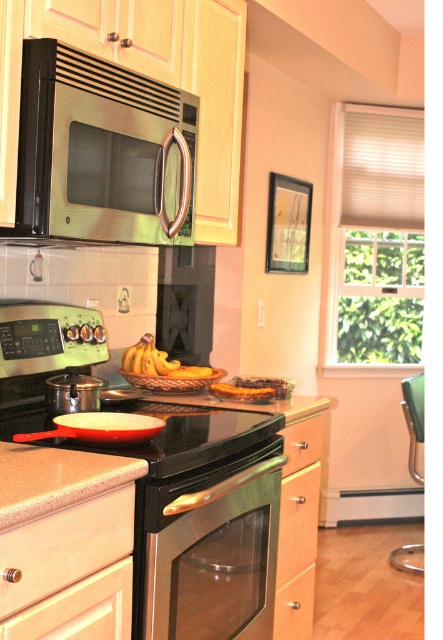
Between white matte drawer at lower left and beige granite countertop at lower center, which one is positioned higher?

beige granite countertop at lower center is above.

Looking at this image, which is more to the right, white matte drawer at lower left or beige granite countertop at lower center?

white matte drawer at lower left is more to the right.

Who is more forward, (131,496) or (24,468)?

Point (24,468) is in front.

At what (x,y) coordinates should I click in order to perform the action: click on white matte drawer at lower left. Please return your answer as a coordinate pair (x, y). The height and width of the screenshot is (640, 443). Looking at the image, I should click on (65, 547).

From the picture: Can you confirm if stainless steel oven at center is shorter than matte wood drawer at lower center?

Incorrect, stainless steel oven at center's height does not fall short of matte wood drawer at lower center's.

Is point (194, 621) positioned behind point (303, 598)?

That is False.

The image size is (443, 640). Find the location of `stainless steel oven at center`. stainless steel oven at center is located at coordinates (209, 548).

Who is more forward, (x=163, y=492) or (x=319, y=440)?

Point (x=163, y=492) is more forward.

Does stainless steel stove at center have a greater width compared to wooden drawer at lower right?

Yes, stainless steel stove at center is wider than wooden drawer at lower right.

Between point (174, 502) and point (294, 456), which one is positioned in front?

Point (174, 502) is in front.

The width and height of the screenshot is (443, 640). I want to click on stainless steel stove at center, so click(139, 524).